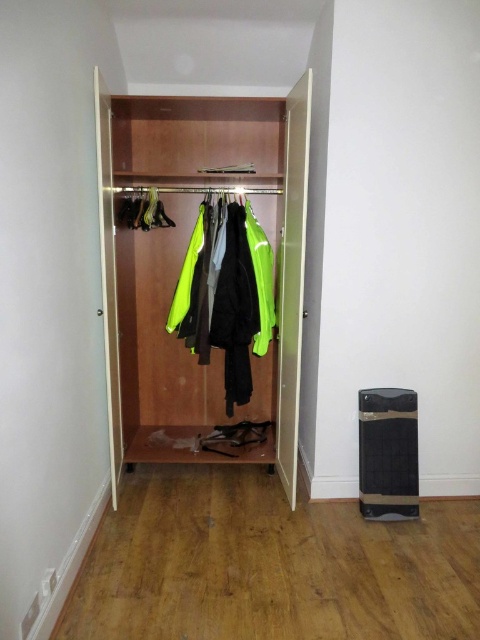
Question: Observing the image, what is the correct spatial positioning of wooden coat rack at center in reference to neon yellow fabric at center?

Choices:
 (A) left
 (B) right

Answer: (A)

Question: Does wooden coat rack at center appear on the right side of neon yellow fabric at center?

Choices:
 (A) yes
 (B) no

Answer: (B)

Question: Which point is farther to the camera?

Choices:
 (A) (211, 273)
 (B) (247, 237)

Answer: (B)

Question: Can you confirm if wooden coat rack at center is smaller than neon yellow fabric at center?

Choices:
 (A) no
 (B) yes

Answer: (A)